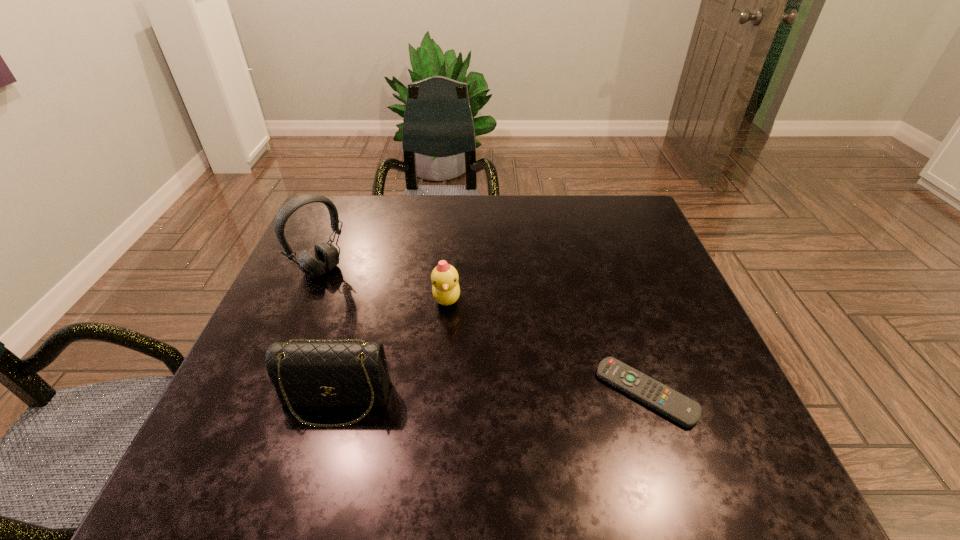
What are the coordinates of `free space between the headset and the third object from left to right` in the screenshot? It's located at (384, 284).

Find the location of `unoccupied position between the duckling and the shortest object`. unoccupied position between the duckling and the shortest object is located at coordinates (546, 346).

Where is `free space between the second object from right to left and the clutch bag`? The width and height of the screenshot is (960, 540). free space between the second object from right to left and the clutch bag is located at coordinates (392, 349).

Locate an element on the screen. Image resolution: width=960 pixels, height=540 pixels. object that is the nearest to the headset is located at coordinates (446, 290).

Point out which object is positioned as the nearest to the remote control. Please provide its 2D coordinates. Your answer should be formatted as a tuple, i.e. [(x, y)], where the tuple contains the x and y coordinates of a point satisfying the conditions above.

[(446, 290)]

Identify the location of free space in the image that satisfies the following two spatial constraints: 1. on the front side of the rightmost object; 2. on the left side of the duckling. The image size is (960, 540). (440, 392).

Where is `free space that satisfies the following two spatial constraints: 1. on the front side of the remote control; 2. on the right side of the duckling`? This screenshot has width=960, height=540. free space that satisfies the following two spatial constraints: 1. on the front side of the remote control; 2. on the right side of the duckling is located at coordinates [x=440, y=392].

The width and height of the screenshot is (960, 540). In order to click on vacant space that satisfies the following two spatial constraints: 1. on the front side of the remote control; 2. on the right side of the headset in this screenshot , I will do pos(271,392).